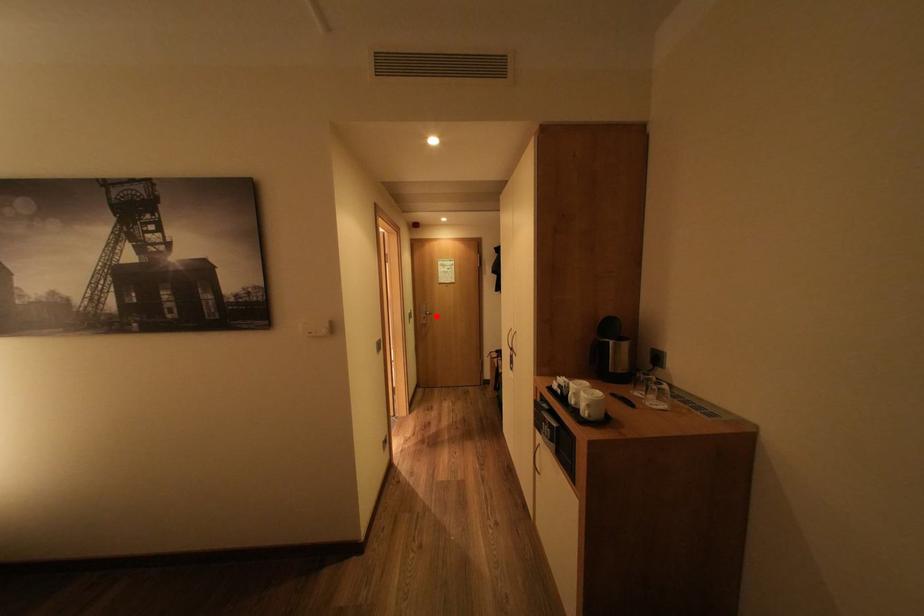
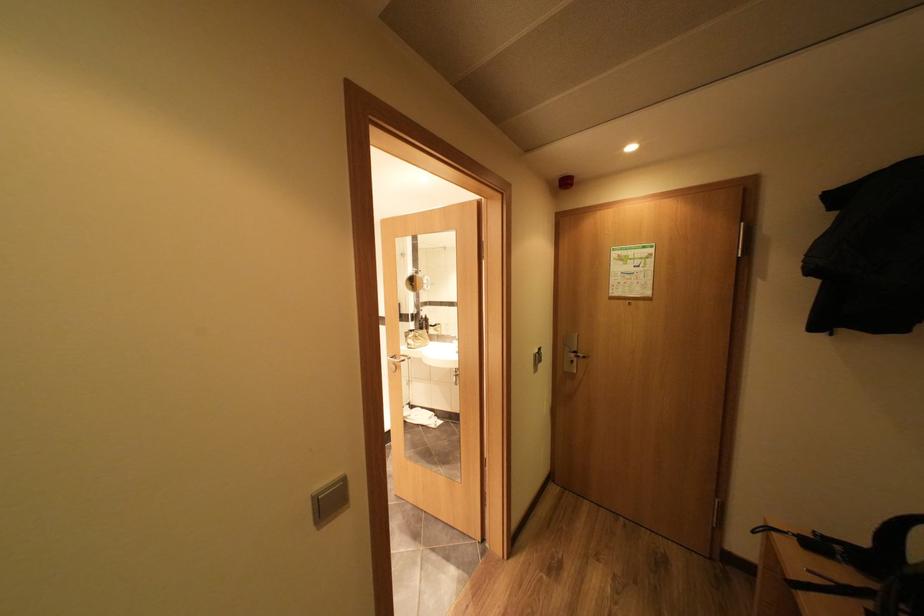
Locate, in the second image, the point that corresponds to the highlighted location in the first image.

(585, 360)